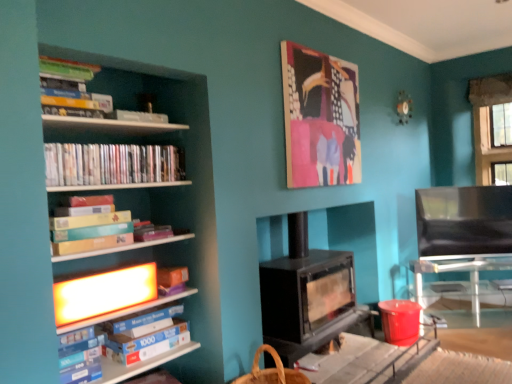
Question: Is black matte wood burning stove at center closer to the viewer compared to canvas painting at upper center?

Choices:
 (A) no
 (B) yes

Answer: (B)

Question: From a real-world perspective, does black matte wood burning stove at center stand above canvas painting at upper center?

Choices:
 (A) no
 (B) yes

Answer: (A)

Question: Does black matte wood burning stove at center have a greater height compared to canvas painting at upper center?

Choices:
 (A) yes
 (B) no

Answer: (A)

Question: Considering the relative sizes of black matte wood burning stove at center and canvas painting at upper center in the image provided, is black matte wood burning stove at center wider than canvas painting at upper center?

Choices:
 (A) yes
 (B) no

Answer: (A)

Question: Is canvas painting at upper center a part of black matte wood burning stove at center?

Choices:
 (A) no
 (B) yes

Answer: (A)

Question: Could you tell me if black matte wood burning stove at center is facing canvas painting at upper center?

Choices:
 (A) no
 (B) yes

Answer: (A)

Question: From the image's perspective, does black leather armchair at right appear higher than black matte wood burning stove at center?

Choices:
 (A) yes
 (B) no

Answer: (A)

Question: From the image's perspective, does black leather armchair at right appear lower than black matte wood burning stove at center?

Choices:
 (A) yes
 (B) no

Answer: (B)

Question: Does black leather armchair at right touch black matte wood burning stove at center?

Choices:
 (A) no
 (B) yes

Answer: (A)

Question: Could you tell me if black leather armchair at right is turned towards black matte wood burning stove at center?

Choices:
 (A) yes
 (B) no

Answer: (B)

Question: From a real-world perspective, is black leather armchair at right physically above black matte wood burning stove at center?

Choices:
 (A) yes
 (B) no

Answer: (A)

Question: Is black leather armchair at right behind black matte wood burning stove at center?

Choices:
 (A) yes
 (B) no

Answer: (A)

Question: From the image's perspective, is black leather armchair at right above matte plastic dvds at left, which ranks as the 1th book in top-to-bottom order?

Choices:
 (A) yes
 (B) no

Answer: (B)